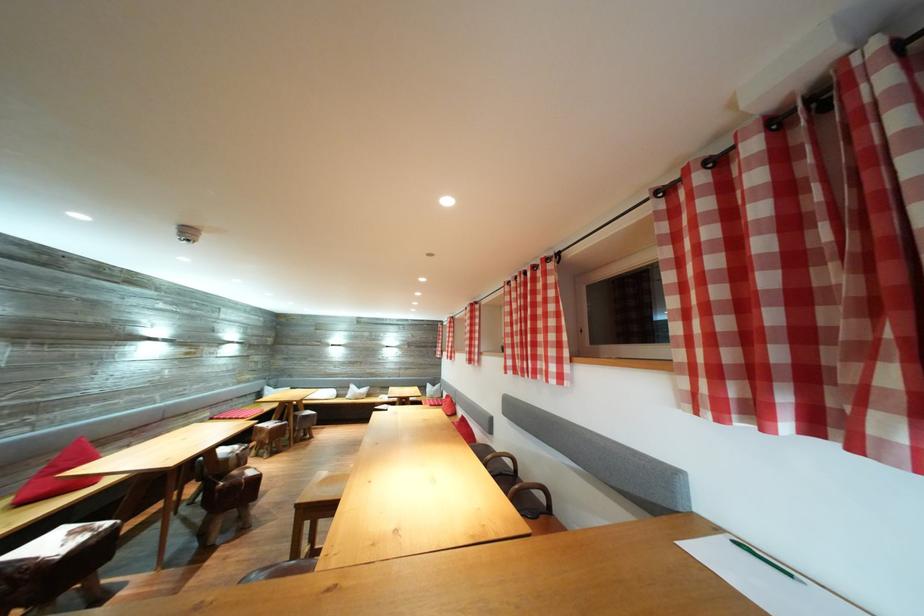
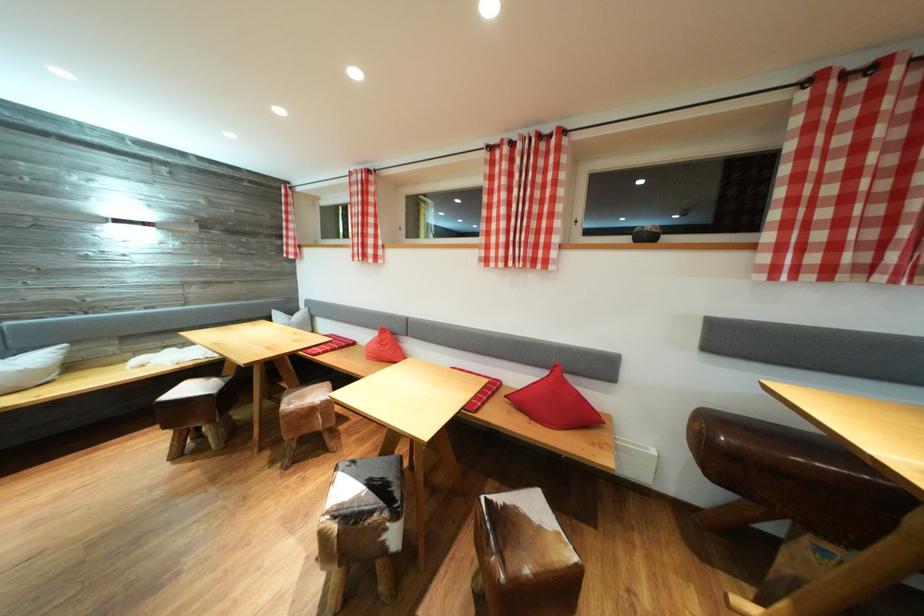
Where in the second image is the point corresponding to point 367,392 from the first image?

(14, 358)